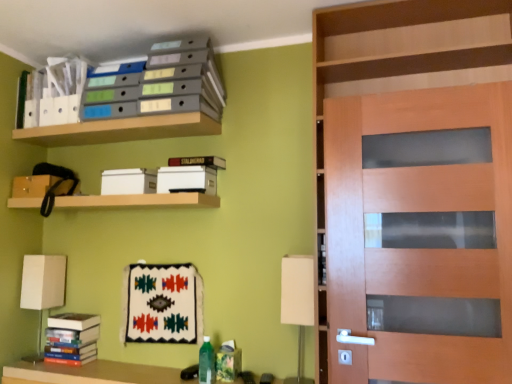
Identify the location of white cardboard box at upper center. (128, 181).

How much space does wooden shelf at upper center, marked as the 2th shelf in a top-to-bottom arrangement, occupy vertically?

2.98 inches.

This screenshot has height=384, width=512. What do you see at coordinates (198, 161) in the screenshot?
I see `hardcover book at upper center, the second book from the left` at bounding box center [198, 161].

The width and height of the screenshot is (512, 384). Describe the element at coordinates (42, 288) in the screenshot. I see `white fabric table lamp at lower left, marked as the 1th table lamp in a left-to-right arrangement` at that location.

This screenshot has height=384, width=512. Identify the location of white cardboard box at upper center. (128, 181).

Based on their sizes in the image, would you say hardcover books at lower left, marked as the 1th book in a left-to-right arrangement, is bigger or smaller than wooden door at right?

Clearly, hardcover books at lower left, marked as the 1th book in a left-to-right arrangement, is smaller in size than wooden door at right.

From a real-world perspective, is hardcover books at lower left, marked as the 1th book in a left-to-right arrangement, located beneath wooden door at right?

Indeed, from a real-world perspective, hardcover books at lower left, marked as the 1th book in a left-to-right arrangement, is positioned beneath wooden door at right.

From the image's perspective, between hardcover books at lower left, which is counted as the 1th book, starting from the bottom, and wooden door at right, which one is located above?

wooden door at right.

From the picture: Are hardcover books at lower left, the second book from the top, and wooden door at right beside each other?

No, hardcover books at lower left, the second book from the top, is not making contact with wooden door at right.

Considering the relative positions of wooden shelf at upper center, the second shelf positioned from the bottom, and white cardboard box at upper center in the image provided, is wooden shelf at upper center, the second shelf positioned from the bottom, to the left or to the right of white cardboard box at upper center?

From the image, it's evident that wooden shelf at upper center, the second shelf positioned from the bottom, is to the left of white cardboard box at upper center.

Considering the sizes of wooden shelf at upper center, marked as the 2th shelf in a top-to-bottom arrangement, and white cardboard box at upper center in the image, is wooden shelf at upper center, marked as the 2th shelf in a top-to-bottom arrangement, taller or shorter than white cardboard box at upper center?

wooden shelf at upper center, marked as the 2th shelf in a top-to-bottom arrangement, is shorter than white cardboard box at upper center.

Does wooden shelf at upper center, the second shelf positioned from the bottom, have a lesser width compared to white cardboard box at upper center?

Incorrect, the width of wooden shelf at upper center, the second shelf positioned from the bottom, is not less than that of white cardboard box at upper center.

Based on the photo, is wooden shelf at upper center, the second shelf positioned from the bottom, positioned far away from white cardboard box at upper center?

Actually, wooden shelf at upper center, the second shelf positioned from the bottom, and white cardboard box at upper center are a little close together.

Would you say white fabric lampshade at lower right, which is counted as the first table lamp, starting from the right, is to the left or to the right of matte plastic file folders at upper center, marked as the first shelf in a top-to-bottom arrangement, in the picture?

white fabric lampshade at lower right, which is counted as the first table lamp, starting from the right, is positioned on matte plastic file folders at upper center, marked as the first shelf in a top-to-bottom arrangement,'s right side.

Would you say white fabric lampshade at lower right, which is counted as the first table lamp, starting from the right, is outside matte plastic file folders at upper center, marked as the first shelf in a top-to-bottom arrangement?

That's correct, white fabric lampshade at lower right, which is counted as the first table lamp, starting from the right, is outside of matte plastic file folders at upper center, marked as the first shelf in a top-to-bottom arrangement.

Which object is thinner, white fabric lampshade at lower right, which is counted as the first table lamp, starting from the right, or matte plastic file folders at upper center, the 3th shelf in the bottom-to-top sequence?

Thinner between the two is white fabric lampshade at lower right, which is counted as the first table lamp, starting from the right.

Is point (297, 316) positioned in front of point (146, 125)?

That is True.

Which table lamp is the 1st one when counting from the left side of the wooden door at right? Please provide its 2D coordinates.

[(297, 302)]

Is white fabric lampshade at lower right, the 2th table lamp positioned from the back, directly adjacent to wooden door at right?

No, white fabric lampshade at lower right, the 2th table lamp positioned from the back, is not making contact with wooden door at right.

Is white fabric lampshade at lower right, placed as the 2th table lamp when sorted from left to right, wider than wooden door at right?

Incorrect, the width of white fabric lampshade at lower right, placed as the 2th table lamp when sorted from left to right, does not surpass that of wooden door at right.

Could you measure the distance between white fabric lampshade at lower right, which appears as the 1th table lamp when viewed from the front, and wooden door at right?

white fabric lampshade at lower right, which appears as the 1th table lamp when viewed from the front, is 18.54 inches away from wooden door at right.

Is white fabric lampshade at lower right, placed as the 2th table lamp when sorted from left to right, to the left of wooden shelf at upper center, acting as the 3th shelf starting from the top, from the viewer's perspective?

No, white fabric lampshade at lower right, placed as the 2th table lamp when sorted from left to right, is not to the left of wooden shelf at upper center, acting as the 3th shelf starting from the top.

Consider the image. From the image's perspective, which object appears higher, white fabric lampshade at lower right, placed as the 2th table lamp when sorted from left to right, or wooden shelf at upper center, acting as the 3th shelf starting from the top?

wooden shelf at upper center, acting as the 3th shelf starting from the top.

How far apart are white fabric lampshade at lower right, the 2th table lamp positioned from the back, and wooden shelf at upper center, acting as the 3th shelf starting from the top?

They are 29.90 inches apart.

What are the coordinates of `table lamp on the right of wooden shelf at upper center, which is counted as the first shelf, starting from the bottom` in the screenshot? It's located at (297, 302).

Is hardcover book at upper center, the second book from the left, positioned beyond the bounds of white fabric lampshade at lower right, placed as the 2th table lamp when sorted from left to right?

Yes.

From a real-world perspective, is hardcover book at upper center, which appears as the first book when viewed from the top, on white fabric lampshade at lower right, the 2th table lamp positioned from the back?

Yes.

Would you say hardcover book at upper center, the second book ordered from the bottom, is a long distance from white fabric lampshade at lower right, the 2th table lamp positioned from the back?

hardcover book at upper center, the second book ordered from the bottom, is near white fabric lampshade at lower right, the 2th table lamp positioned from the back, not far away.

Between hardcover book at upper center, which is the 1th book in right-to-left order, and white fabric lampshade at lower right, the 2th table lamp positioned from the back, which one has larger size?

Bigger between the two is white fabric lampshade at lower right, the 2th table lamp positioned from the back.

From the picture: From a real-world perspective, between hardcover books at lower left, the 2th book when ordered from right to left, and white fabric table lamp at lower left, which appears as the first table lamp when viewed from the back, who is vertically higher?

In real-world perspective, white fabric table lamp at lower left, which appears as the first table lamp when viewed from the back, is above.

Could you measure the distance between hardcover books at lower left, the second book from the top, and white fabric table lamp at lower left, marked as the 1th table lamp in a left-to-right arrangement?

hardcover books at lower left, the second book from the top, and white fabric table lamp at lower left, marked as the 1th table lamp in a left-to-right arrangement, are 8.97 inches apart.

Is hardcover books at lower left, the 2th book when ordered from right to left, not within white fabric table lamp at lower left, placed as the second table lamp when sorted from front to back?

Yes, hardcover books at lower left, the 2th book when ordered from right to left, is located beyond the bounds of white fabric table lamp at lower left, placed as the second table lamp when sorted from front to back.

Consider the image. Which object is positioned more to the left, hardcover books at lower left, the 2th book when ordered from right to left, or white fabric table lamp at lower left, marked as the 2th table lamp in a right-to-left arrangement?

From the viewer's perspective, white fabric table lamp at lower left, marked as the 2th table lamp in a right-to-left arrangement, appears more on the left side.

Locate an element on the screen. The image size is (512, 384). door above the hardcover books at lower left, which is counted as the 1th book, starting from the bottom (from a real-world perspective) is located at coordinates (420, 234).

Identify the location of shelf that is the 1st object located above the white cardboard box at upper center (from the image's perspective). (120, 130).

Estimate the real-world distances between objects in this image. Which object is closer to wooden door at right, hardcover book at upper center, which is the 1th book in right-to-left order, or white fabric table lamp at lower left, placed as the second table lamp when sorted from front to back?

hardcover book at upper center, which is the 1th book in right-to-left order, is positioned closer to the anchor wooden door at right.

Looking at the image, which one is located closer to wooden shelf at upper center, acting as the 3th shelf starting from the top, hardcover book at upper center, which appears as the first book when viewed from the top, or white fabric lampshade at lower right, which is counted as the first table lamp, starting from the right?

hardcover book at upper center, which appears as the first book when viewed from the top, is closer to wooden shelf at upper center, acting as the 3th shelf starting from the top.

Considering their positions, is white cardboard box at upper center positioned closer to wooden shelf at upper center, acting as the 3th shelf starting from the top, than wooden shelf at upper center, marked as the 2th shelf in a top-to-bottom arrangement?

white cardboard box at upper center is positioned closer to the anchor wooden shelf at upper center, acting as the 3th shelf starting from the top.

Based on their spatial positions, is wooden door at right or wooden shelf at upper center, which is counted as the first shelf, starting from the bottom, further from matte plastic file folders at upper center, the 3th shelf in the bottom-to-top sequence?

wooden door at right is further to matte plastic file folders at upper center, the 3th shelf in the bottom-to-top sequence.

When comparing their distances from wooden door at right, does white fabric table lamp at lower left, marked as the 2th table lamp in a right-to-left arrangement, or wooden shelf at upper center, the second shelf positioned from the bottom, seem closer?

wooden shelf at upper center, the second shelf positioned from the bottom, is closer to wooden door at right.

Based on their spatial positions, is wooden door at right or hardcover book at upper center, the second book from the left, closer to matte plastic file folders at upper center, the 3th shelf in the bottom-to-top sequence?

hardcover book at upper center, the second book from the left, lies closer to matte plastic file folders at upper center, the 3th shelf in the bottom-to-top sequence, than the other object.

Looking at the image, which one is located further to white fabric table lamp at lower left, placed as the second table lamp when sorted from front to back, hardcover book at upper center, the second book from the left, or wooden shelf at upper center, acting as the 3th shelf starting from the top?

Among the two, hardcover book at upper center, the second book from the left, is located further to white fabric table lamp at lower left, placed as the second table lamp when sorted from front to back.

Estimate the real-world distances between objects in this image. Which object is closer to wooden shelf at upper center, the second shelf positioned from the bottom, hardcover books at lower left, the second book from the top, or matte plastic file folders at upper center, the 3th shelf in the bottom-to-top sequence?

Based on the image, matte plastic file folders at upper center, the 3th shelf in the bottom-to-top sequence, appears to be nearer to wooden shelf at upper center, the second shelf positioned from the bottom.

Locate an element on the screen. This screenshot has width=512, height=384. table lamp between white fabric table lamp at lower left, placed as the second table lamp when sorted from front to back, and wooden door at right is located at coordinates click(297, 302).

This screenshot has height=384, width=512. Find the location of `door that lies between matte plastic file folders at upper center, the 3th shelf in the bottom-to-top sequence, and white fabric lampshade at lower right, placed as the 2th table lamp when sorted from left to right, from top to bottom`. door that lies between matte plastic file folders at upper center, the 3th shelf in the bottom-to-top sequence, and white fabric lampshade at lower right, placed as the 2th table lamp when sorted from left to right, from top to bottom is located at coordinates pyautogui.click(x=420, y=234).

I want to click on storage box between matte plastic file folders at upper center, marked as the first shelf in a top-to-bottom arrangement, and white fabric table lamp at lower left, placed as the second table lamp when sorted from front to back, from top to bottom, so click(x=128, y=181).

This screenshot has width=512, height=384. What are the coordinates of `storage box between matte plastic file folders at upper center, the 3th shelf in the bottom-to-top sequence, and hardcover books at lower left, which is counted as the 1th book, starting from the bottom, in the up-down direction` in the screenshot? It's located at (128, 181).